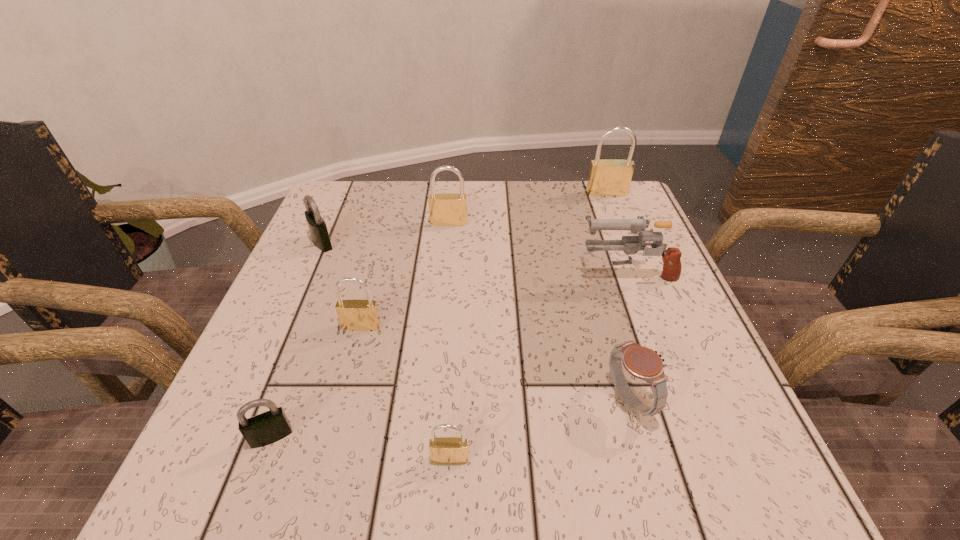
Find the location of a particular element. The width and height of the screenshot is (960, 540). the smaller black padlock is located at coordinates (266, 428).

Locate an element on the screen. The width and height of the screenshot is (960, 540). the nearer black padlock is located at coordinates (266, 428).

Locate an element on the screen. the nearest padlock is located at coordinates (445, 450).

At what (x,y) coordinates should I click in order to perform the action: click on the nearest object. Please return your answer as a coordinate pair (x, y). Looking at the image, I should click on (445, 450).

The width and height of the screenshot is (960, 540). Find the location of `vacant space situated 0.200m on the front-facing side of the farthest padlock`. vacant space situated 0.200m on the front-facing side of the farthest padlock is located at coordinates (627, 244).

This screenshot has height=540, width=960. In order to click on free location located 0.280m on the front-facing side of the second biggest brass padlock in this screenshot , I will do `click(441, 313)`.

The width and height of the screenshot is (960, 540). I want to click on free spot located at the barrel end of the gun, so click(x=435, y=273).

Locate an element on the screen. vacant area situated at the barrel end of the gun is located at coordinates (406, 273).

In order to click on vacant space located 0.070m at the barrel end of the gun in this screenshot , I will do `click(545, 273)`.

You are a GUI agent. You are given a task and a screenshot of the screen. Output one action in this format:
    pyautogui.click(x=<x>, y=<y>)
    Task: Click on the vacant area situated on the front of the third farthest padlock
    Image resolution: width=960 pixels, height=540 pixels.
    Given the screenshot: What is the action you would take?
    pyautogui.click(x=277, y=345)